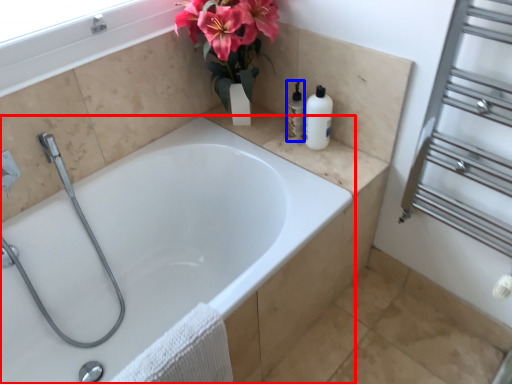
Question: Which object appears farthest to the camera in this image, bathtub (highlighted by a red box) or toiletry (highlighted by a blue box)?

Choices:
 (A) bathtub
 (B) toiletry

Answer: (B)